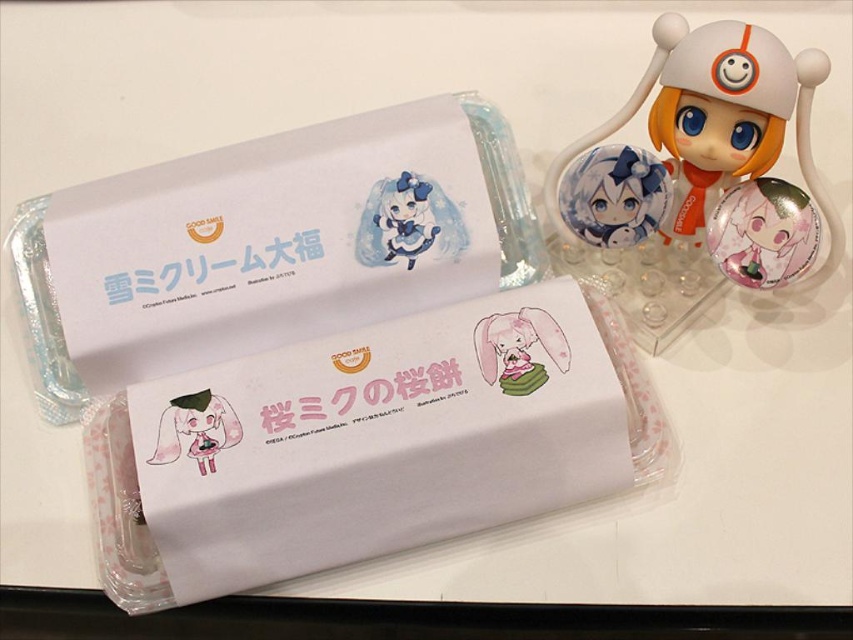
Which is in front, point (616, 205) or point (491, 355)?

Point (491, 355) is more forward.

Who is positioned more to the right, matte plastic figurine at upper right or pink matte plush rabbit at center?

matte plastic figurine at upper right

Which is behind, point (596, 160) or point (515, 356)?

Point (596, 160)

You are a GUI agent. You are given a task and a screenshot of the screen. Output one action in this format:
    pyautogui.click(x=<x>, y=<y>)
    Task: Click on the matte plastic figurine at upper right
    This screenshot has height=640, width=853.
    Given the screenshot: What is the action you would take?
    pyautogui.click(x=614, y=195)

Is white paper box at center wider than matte plastic figurine at upper right?

Yes.

Is point (306, 282) in front of point (631, 218)?

No, (306, 282) is behind (631, 218).

You are a GUI agent. You are given a task and a screenshot of the screen. Output one action in this format:
    pyautogui.click(x=<x>, y=<y>)
    Task: Click on the white paper box at center
    This screenshot has height=640, width=853.
    Given the screenshot: What is the action you would take?
    pyautogui.click(x=288, y=237)

Is pink matte paper box at center smaller than pink glossy plushie at center?

No.

Which is behind, point (503, 316) or point (216, 404)?

The point (503, 316) is more distant.

The image size is (853, 640). I want to click on pink matte paper box at center, so click(x=376, y=440).